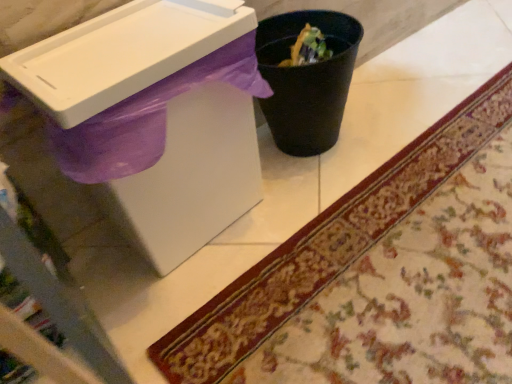
Where is `free region under carpeted mat at lower right (from a real-world perspective)`? This screenshot has height=384, width=512. free region under carpeted mat at lower right (from a real-world perspective) is located at coordinates (376, 277).